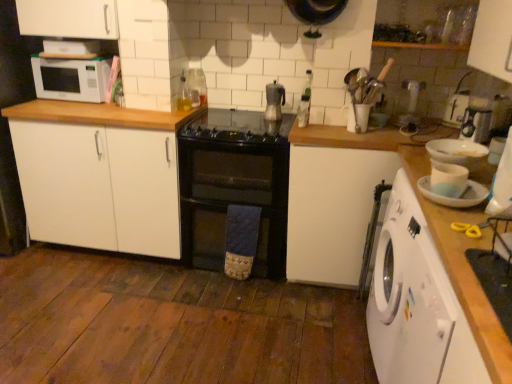
Locate an element on the screen. free location above white glossy mug at upper right, placed as the 3th appliance when sorted from top to bottom (from a real-world perspective) is located at coordinates (445, 176).